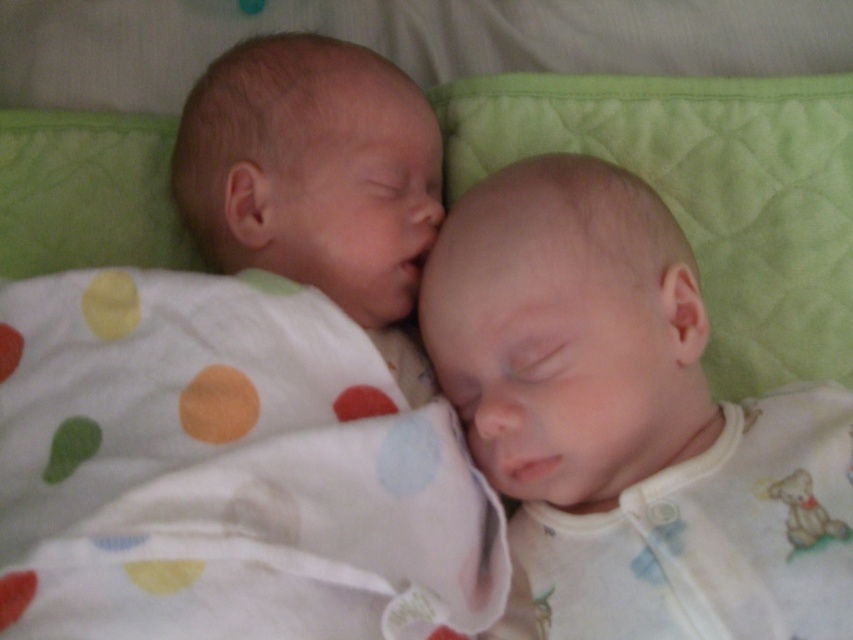
You are a photographer taking a photo of two sleeping babies. You need to adjust your camera focus to ensure both points are in focus. Given that point (337, 304) and point (799, 548) are important for the composition, which point should you focus on first to ensure depth of field covers both?

You should focus on point (337, 304) first because it is closer to the viewer than point (799, 548). This ensures the depth of field will cover both points as the closer object is prioritized for sharpness.

You are a nurse in a hospital nursery. You need to check on two babies lying on a green quilted surface. The babies are labeled as smooth skin newborn at center and smooth white baby at center. Which baby is closer to you?

The smooth skin newborn at center is closer to you since it is in front of the smooth white baby at center.

You are holding a toy that is 12 inches long and want to place it on the spot marked by point (x=206, y=520). Considering the distance from your current position to that point, will the toy fit entirely within the area marked by that point?

The point (x=206, y=520) is 25.35 inches away from the viewer. Since the toy is only 12 inches long, placing it at that distance would require reaching that far, but the toy itself will fit entirely within the area marked by the point as its length is shorter than the distance.